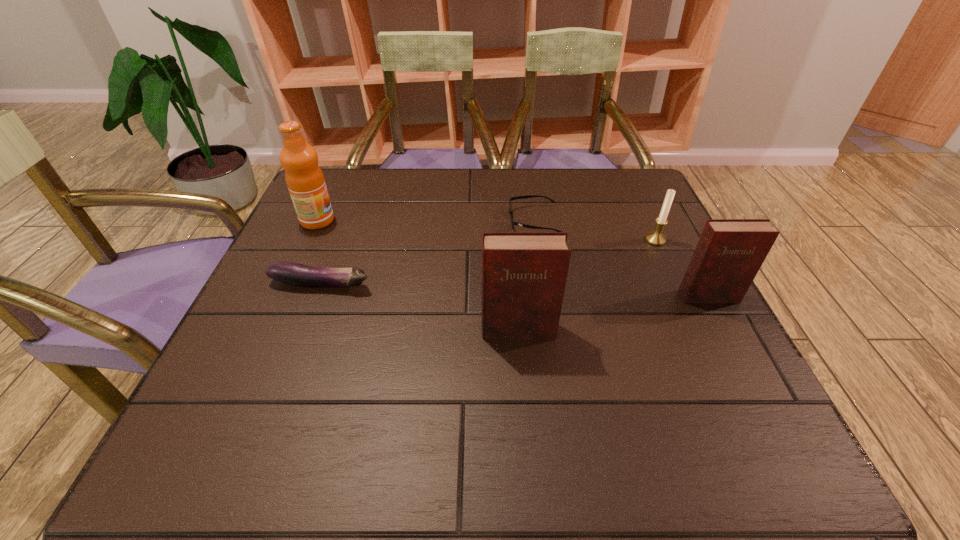
The height and width of the screenshot is (540, 960). Identify the location of the taller diary. (523, 274).

Where is `the second tallest object`? This screenshot has width=960, height=540. the second tallest object is located at coordinates (523, 274).

You are a GUI agent. You are given a task and a screenshot of the screen. Output one action in this format:
    pyautogui.click(x=<x>, y=<y>)
    Task: Click on the fourth shortest object
    The image size is (960, 540).
    Given the screenshot: What is the action you would take?
    tap(729, 253)

Locate an element on the screen. This screenshot has width=960, height=540. the farther diary is located at coordinates (729, 253).

Find the location of a particular element. This screenshot has height=540, width=960. candle holder is located at coordinates (656, 238).

Where is `the shortest object`? The height and width of the screenshot is (540, 960). the shortest object is located at coordinates (512, 222).

Identify the location of fruit juice. The width and height of the screenshot is (960, 540). (304, 178).

Where is `eggplant`? The image size is (960, 540). eggplant is located at coordinates (291, 273).

You are a GUI agent. You are given a task and a screenshot of the screen. Output one action in this format:
    pyautogui.click(x=<x>, y=<y>)
    Task: Click on the free space located 0.110m on the front cover of the left diary
    
    Given the screenshot: What is the action you would take?
    tap(522, 389)

This screenshot has width=960, height=540. What are the coordinates of `vacant space located 0.160m on the front cover of the third tallest object` in the screenshot? It's located at (745, 366).